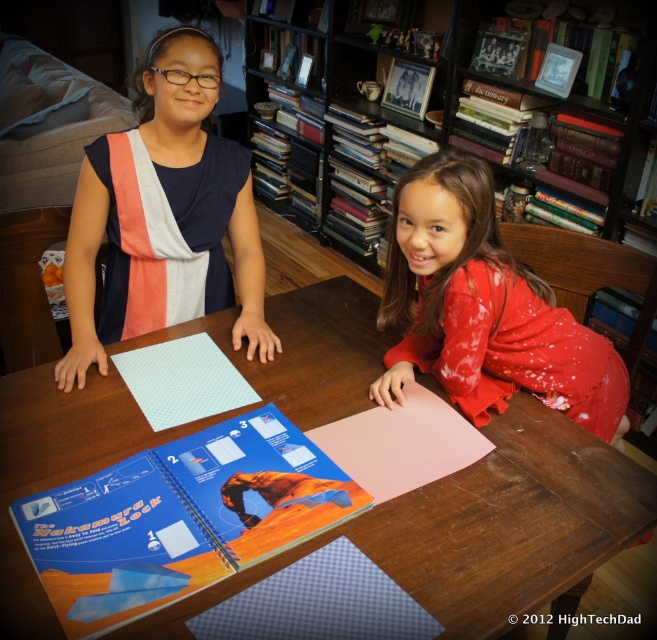
Based on the scene description, where is the blue glossy book at center located in terms of coordinates?

The blue glossy book at center is located at coordinates point (179,518).

You are trying to decide which item is easier to carry in your bag. The blue glossy book at center and the matte red dress at lower right are both in your bag. Which item takes up less space?

The blue glossy book at center is thinner than the matte red dress at lower right, so it takes up less space and is easier to carry.